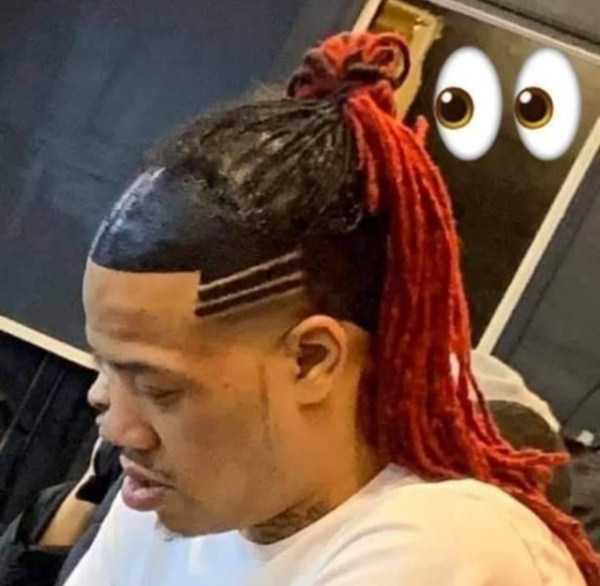
You are a GUI agent. You are given a task and a screenshot of the screen. Output one action in this format:
    pyautogui.click(x=<x>, y=<y>)
    Task: Click on the vent
    The width and height of the screenshot is (600, 586).
    Given the screenshot: What is the action you would take?
    pyautogui.click(x=56, y=453)